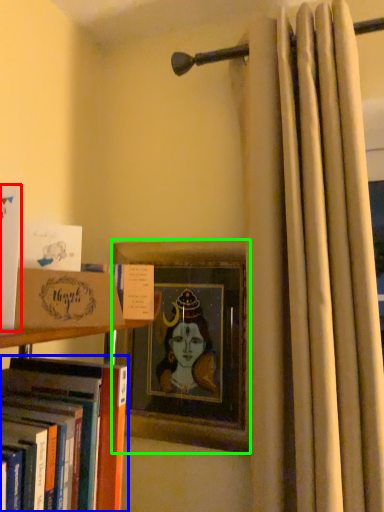
Question: Which is farther away from book (highlighted by a red box)? book (highlighted by a blue box) or picture frame (highlighted by a green box)?

Choices:
 (A) book
 (B) picture frame

Answer: (B)